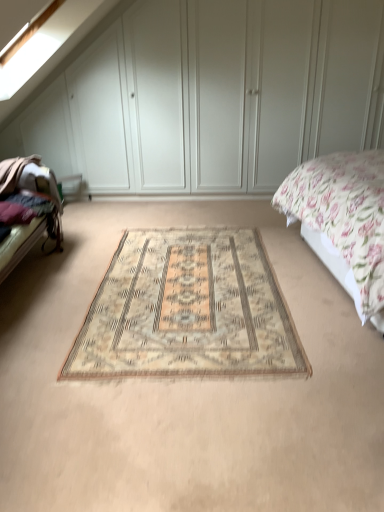
Where is `free space in front of beige woven rug at center`? free space in front of beige woven rug at center is located at coordinates (193, 416).